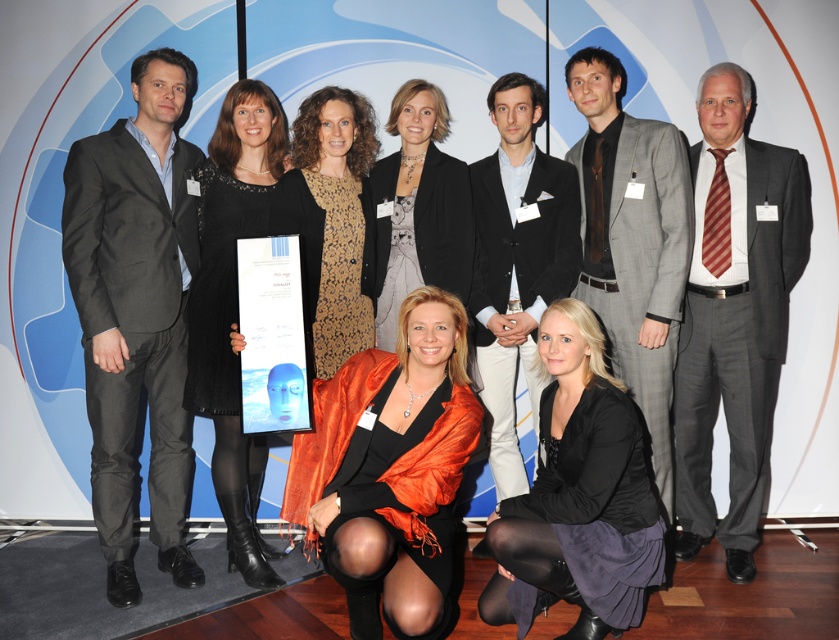
You are organizing a photo shoot and need to ensure that all participants are visible in the final image. Given that the black suit at center and the matte black dress at center are both in the center of the frame, which one might appear more prominent in the photo?

The black suit at center appears more prominent because it has a larger size compared to the matte black dress at center.

You are a photographer adjusting the camera focus for the group photo. You need to focus on both the black suit at center and the black lace dress at center. Which one should you focus on first to ensure both are in sharp focus?

You should focus on the black suit at center first because it is closer to the viewer than the black lace dress at center. By focusing on the closer object first, you can adjust the depth of field to include both in sharp focus.